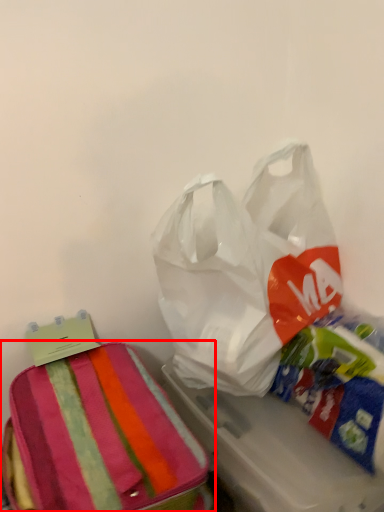
Question: From the image's perspective, where is luggage and bags (annotated by the red box) located in relation to plastic bag in the image?

Choices:
 (A) below
 (B) above

Answer: (A)